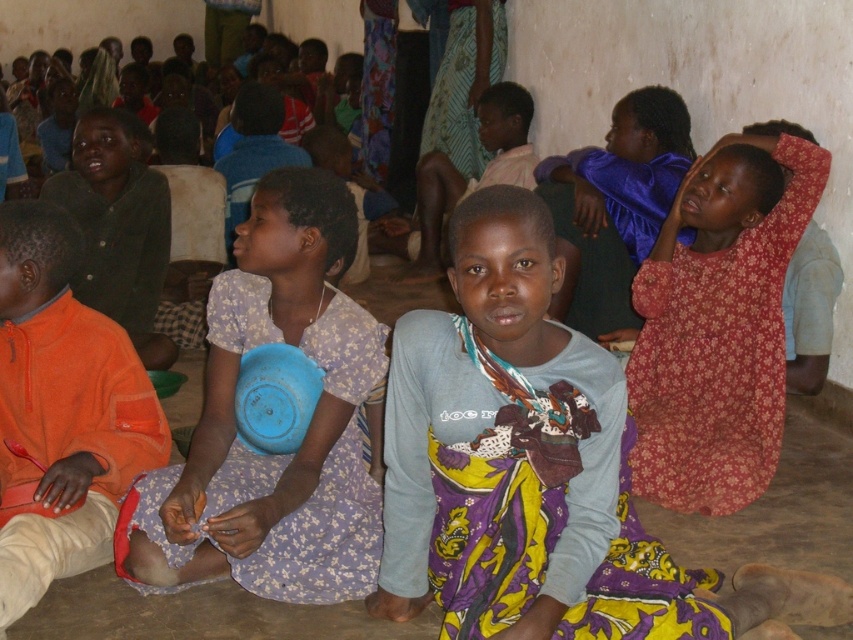
Consider the image. Can you confirm if floral fabric dress at right is positioned to the left of shiny purple blouse at upper right?

In fact, floral fabric dress at right is to the right of shiny purple blouse at upper right.

Can you confirm if floral fabric dress at right is bigger than shiny purple blouse at upper right?

Incorrect, floral fabric dress at right is not larger than shiny purple blouse at upper right.

Who is more distant from viewer, (714, 422) or (630, 246)?

The point (630, 246) is more distant.

This screenshot has width=853, height=640. What are the coordinates of `floral fabric dress at right` in the screenshot? It's located at coord(718,355).

Is shiny purple blouse at upper right taller than blue fabric skirt at upper center?

In fact, shiny purple blouse at upper right may be shorter than blue fabric skirt at upper center.

Does shiny purple blouse at upper right appear under blue fabric skirt at upper center?

Yes, shiny purple blouse at upper right is below blue fabric skirt at upper center.

In the scene shown: Measure the distance between shiny purple blouse at upper right and camera.

shiny purple blouse at upper right is 3.63 meters from camera.

I want to click on shiny purple blouse at upper right, so click(x=614, y=205).

Can you confirm if purple floral dress at center is smaller than dark green shirt at upper left?

Actually, purple floral dress at center might be larger than dark green shirt at upper left.

Which is more to the left, purple floral dress at center or dark green shirt at upper left?

Positioned to the left is dark green shirt at upper left.

This screenshot has height=640, width=853. Find the location of `purple floral dress at center`. purple floral dress at center is located at coordinates (305, 432).